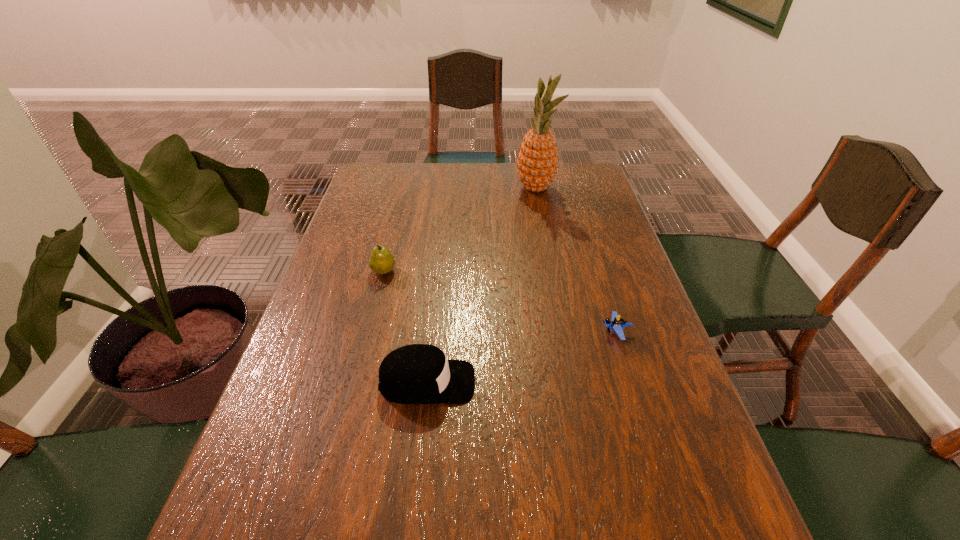
In the image, there is a desktop. Identify the location of free space at the left edge. The image size is (960, 540). click(362, 269).

Identify the location of free space at the right edge of the desktop. (652, 503).

In the image, there is a desktop. Identify the location of free space at the far right corner. (564, 187).

The width and height of the screenshot is (960, 540). Identify the location of vacant area that lies between the pineapple and the third object from right to left. (481, 285).

Locate an element on the screen. The image size is (960, 540). free space between the tallest object and the leftmost object is located at coordinates (460, 230).

In order to click on free space that is in between the shortest object and the farthest object in this screenshot , I will do `click(575, 260)`.

This screenshot has width=960, height=540. I want to click on free point between the cap and the pear, so click(405, 327).

This screenshot has height=540, width=960. Identify the location of empty space that is in between the leftmost object and the shortest object. (499, 302).

Identify the location of free space that is in between the tallest object and the rightmost object. The width and height of the screenshot is (960, 540). 575,260.

Where is `vacant point located between the third object from right to left and the pineapple`? vacant point located between the third object from right to left and the pineapple is located at coordinates (481, 285).